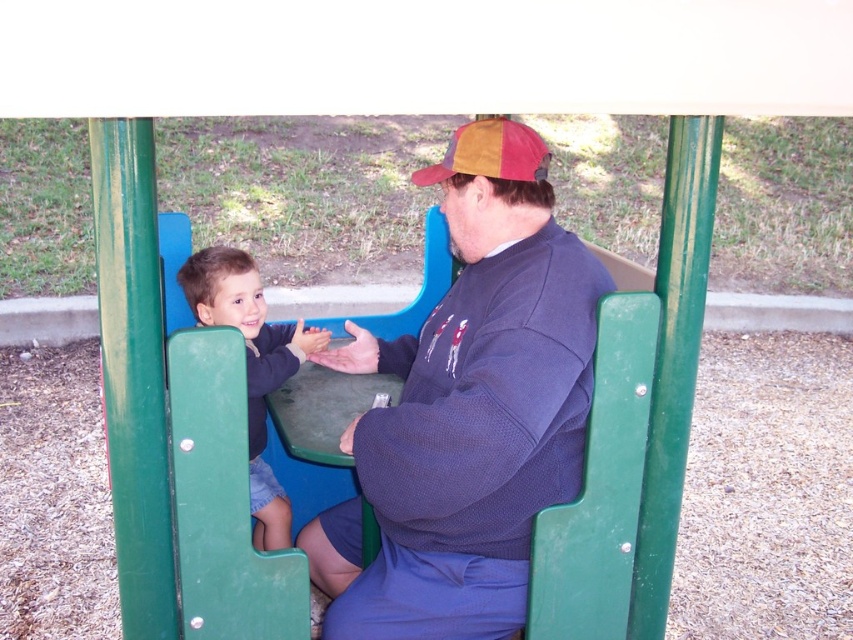
Question: Which of the following is the closest to the observer?

Choices:
 (A) dark blue sweater at center
 (B) matte blue shirt at left

Answer: (A)

Question: Is matte blue shirt at left wider than multicolored fabric baseball cap at upper center?

Choices:
 (A) yes
 (B) no

Answer: (A)

Question: Can you confirm if dark blue sweater at center is thinner than multicolored fabric baseball cap at upper center?

Choices:
 (A) no
 (B) yes

Answer: (A)

Question: Which object is the closest to the multicolored fabric baseball cap at upper center?

Choices:
 (A) dark blue sweater at center
 (B) matte blue shirt at left

Answer: (A)

Question: Which object is farther from the camera taking this photo?

Choices:
 (A) matte blue shirt at left
 (B) dark blue sweater at center
 (C) multicolored fabric baseball cap at upper center

Answer: (A)

Question: Observing the image, what is the correct spatial positioning of dark blue sweater at center in reference to matte blue shirt at left?

Choices:
 (A) left
 (B) right

Answer: (B)